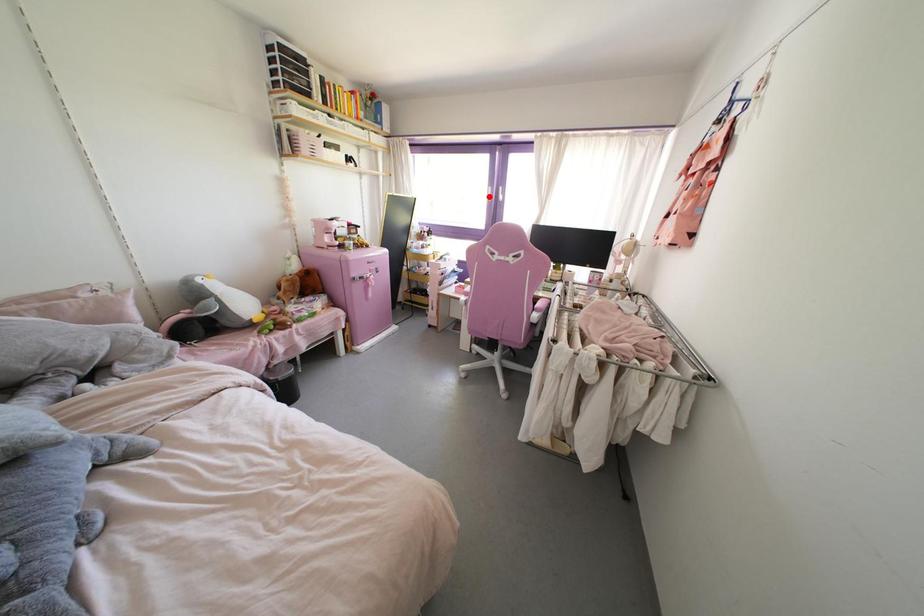
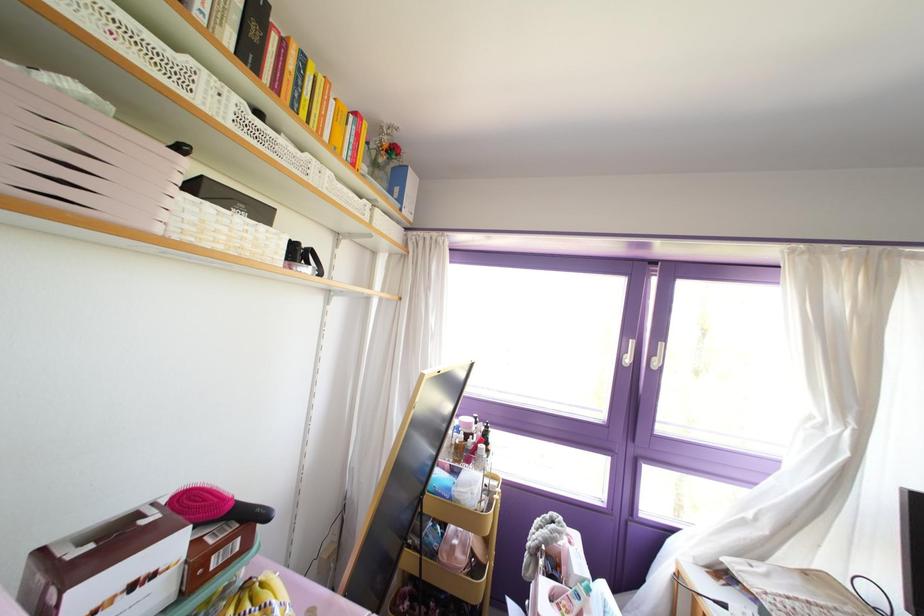
The point at the highlighted location is marked in the first image. Where is the corresponding point in the second image?

(626, 360)